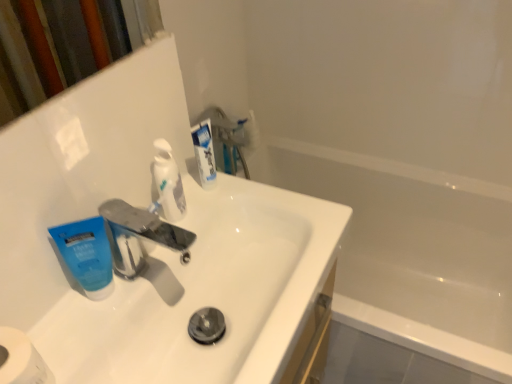
At what (x,y) coordinates should I click in order to perform the action: click on free spot to the right of white glossy toothpaste at upper center, placed as the 1th toothpaste when sorted from right to left. Please return your answer as a coordinate pair (x, y). This screenshot has height=384, width=512. Looking at the image, I should click on (276, 210).